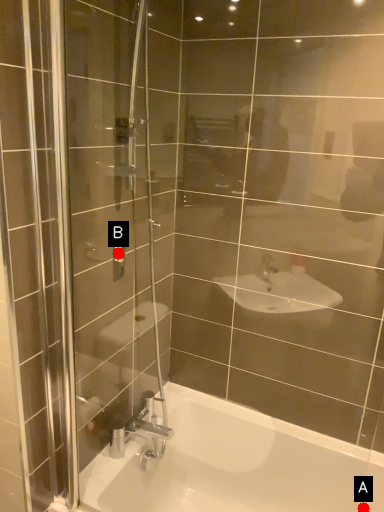
Question: Two points are circled on the image, labeled by A and B beside each circle. Which point appears closest to the camera in this image?

Choices:
 (A) A is closer
 (B) B is closer

Answer: (B)